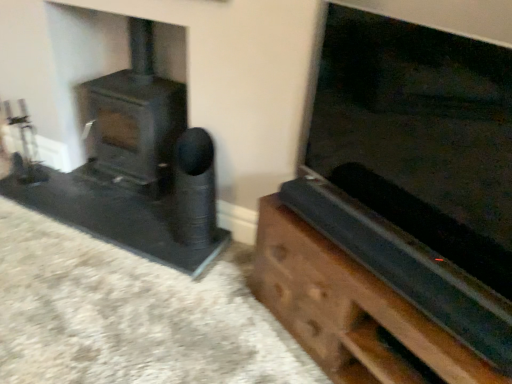
Question: From a real-world perspective, is matte black wood burning stove at left located beneath wooden chest at right?

Choices:
 (A) yes
 (B) no

Answer: (B)

Question: Does matte black wood burning stove at left appear on the left side of wooden chest at right?

Choices:
 (A) no
 (B) yes

Answer: (B)

Question: Considering the relative sizes of matte black wood burning stove at left and wooden chest at right in the image provided, is matte black wood burning stove at left shorter than wooden chest at right?

Choices:
 (A) yes
 (B) no

Answer: (B)

Question: Is wooden chest at right inside matte black wood burning stove at left?

Choices:
 (A) no
 (B) yes

Answer: (A)

Question: From a real-world perspective, is matte black wood burning stove at left physically above wooden chest at right?

Choices:
 (A) no
 (B) yes

Answer: (B)

Question: In terms of height, does black matte speaker at center look taller or shorter compared to wooden chest at right?

Choices:
 (A) short
 (B) tall

Answer: (B)

Question: Is black matte speaker at center situated inside wooden chest at right or outside?

Choices:
 (A) outside
 (B) inside

Answer: (A)

Question: Based on their positions, is black matte speaker at center located to the left or right of wooden chest at right?

Choices:
 (A) left
 (B) right

Answer: (A)

Question: From the image's perspective, is black matte speaker at center located above or below wooden chest at right?

Choices:
 (A) above
 (B) below

Answer: (A)

Question: From a real-world perspective, is wooden chest at right physically located above or below black matte speaker at center?

Choices:
 (A) below
 (B) above

Answer: (A)

Question: Is wooden chest at right taller or shorter than black matte speaker at center?

Choices:
 (A) short
 (B) tall

Answer: (A)

Question: In the image, is wooden chest at right positioned in front of or behind black matte speaker at center?

Choices:
 (A) behind
 (B) front

Answer: (B)

Question: Based on their positions, is wooden chest at right located to the left or right of black matte speaker at center?

Choices:
 (A) right
 (B) left

Answer: (A)

Question: From the image's perspective, relative to matte black wood burning stove at left, is black matte speaker at center above or below?

Choices:
 (A) below
 (B) above

Answer: (A)

Question: From a real-world perspective, relative to matte black wood burning stove at left, is black matte speaker at center vertically above or below?

Choices:
 (A) below
 (B) above

Answer: (A)